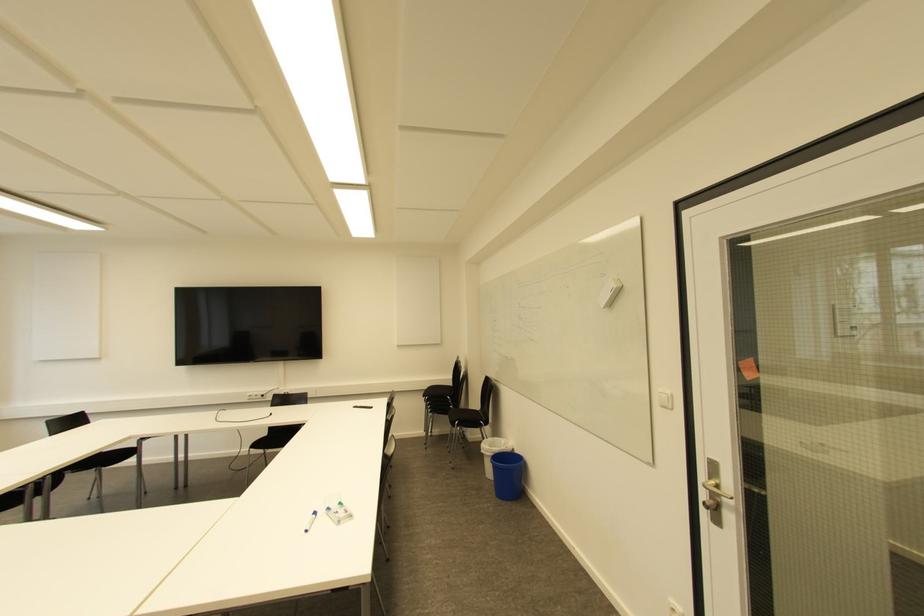
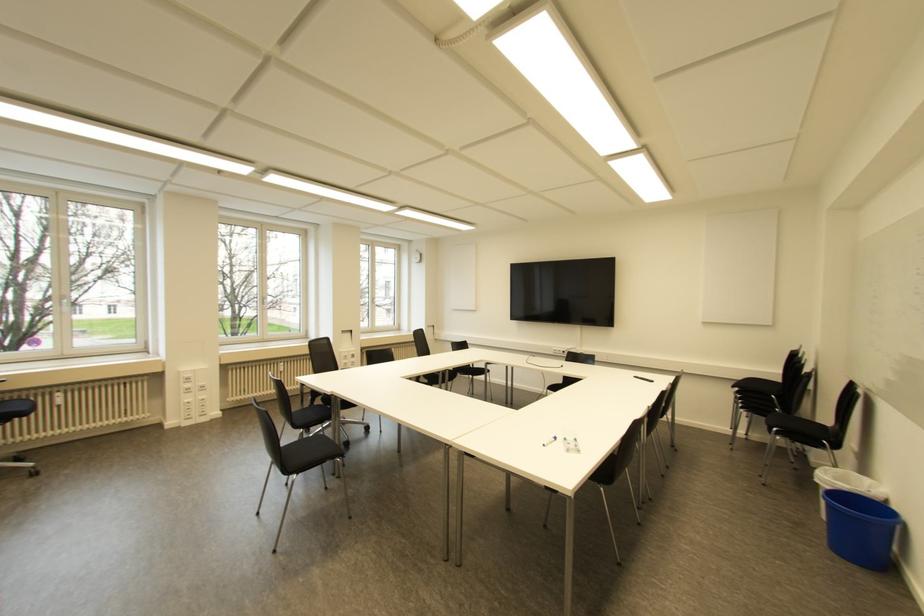
Locate, in the second image, the point that corresponds to the point at 511,472 in the first image.

(864, 527)